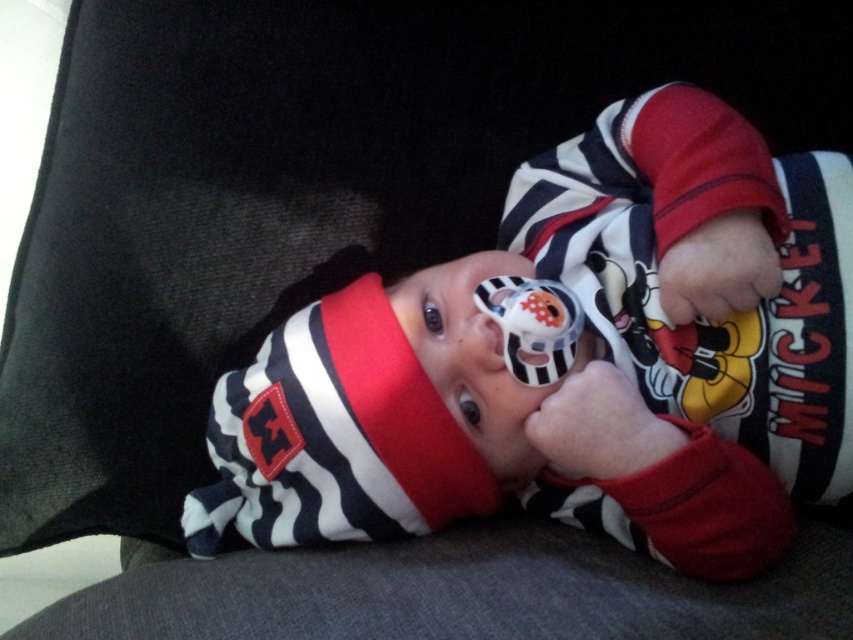
Question: Observing the image, what is the correct spatial positioning of striped fabric baby at center in reference to matte plastic pacifier at center?

Choices:
 (A) right
 (B) left

Answer: (B)

Question: Which point is closer to the camera taking this photo?

Choices:
 (A) (556, 330)
 (B) (840, 488)

Answer: (B)

Question: Among these objects, which one is farthest from the camera?

Choices:
 (A) matte plastic pacifier at center
 (B) striped fabric baby at center

Answer: (A)

Question: Does striped fabric baby at center appear on the left side of matte plastic pacifier at center?

Choices:
 (A) yes
 (B) no

Answer: (A)

Question: From the image, what is the correct spatial relationship of striped fabric baby at center in relation to matte plastic pacifier at center?

Choices:
 (A) right
 (B) left

Answer: (B)